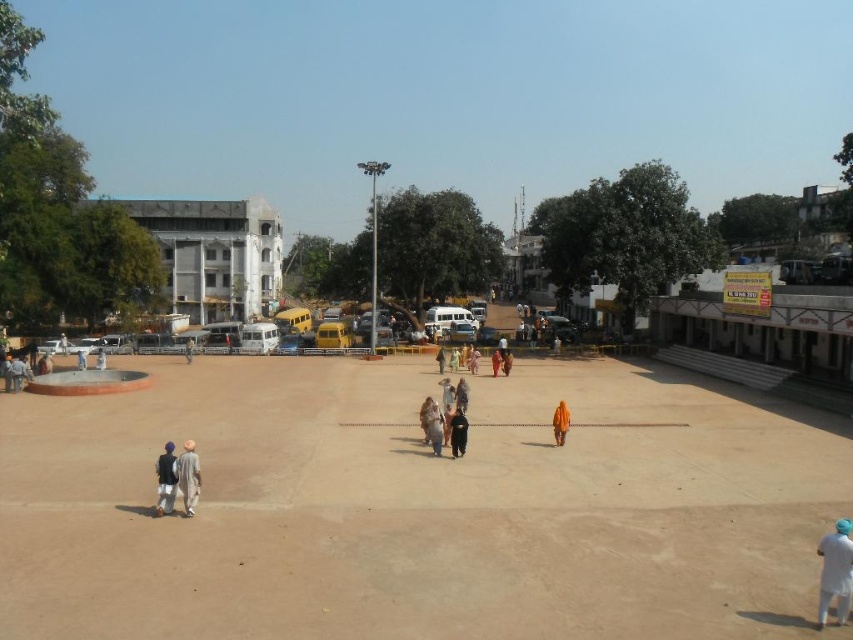
You are standing at the center of the plaza and want to walk to the point marked by point (183, 467). However, there is an obstacle at point (451, 429). Will you encounter the obstacle on your way?

Point (183, 467) is in front of point (451, 429), so you will not encounter the obstacle on your way.

You are standing in the plaza and see the dark brown leather bag at center and the orange fabric person at center. If you want to pick up the bag without getting too close to the person, can you reach it while staying at least 3 meters away from them?

The dark brown leather bag at center is 3.49 meters from the orange fabric person at center. Since 3.49 meters is more than 3 meters, you can safely pick up the bag while staying at least 3 meters away from the orange fabric person at center.